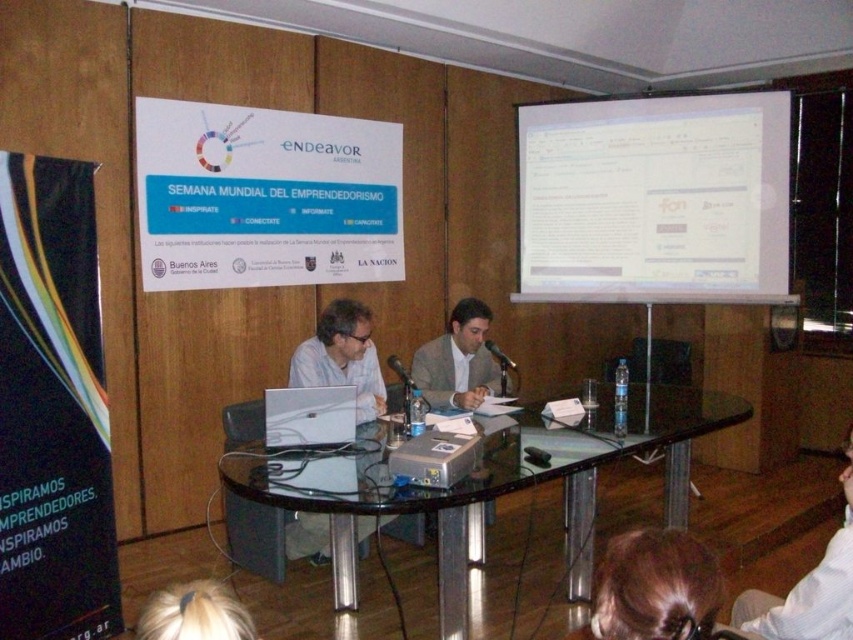
Question: Among these points, which one is farthest from the camera?

Choices:
 (A) (239, 608)
 (B) (622, 109)
 (C) (173, 272)

Answer: (B)

Question: Can you confirm if brown hair at lower center is smaller than light brown suit at center?

Choices:
 (A) yes
 (B) no

Answer: (A)

Question: Does transparent glass table at center have a smaller size compared to matte white laptop at center?

Choices:
 (A) yes
 (B) no

Answer: (B)

Question: Which object is positioned closest to the matte white laptop at center?

Choices:
 (A) white fabric shirt at lower right
 (B) white paper at upper center
 (C) metallic projector at center
 (D) white matte projection screen at upper center

Answer: (C)

Question: Is light brown suit at center below silver metallic laptop at center?

Choices:
 (A) yes
 (B) no

Answer: (B)

Question: Which of the following is the farthest from the observer?

Choices:
 (A) (665, 465)
 (B) (312, 339)
 (C) (167, 204)
 (D) (798, 611)

Answer: (A)